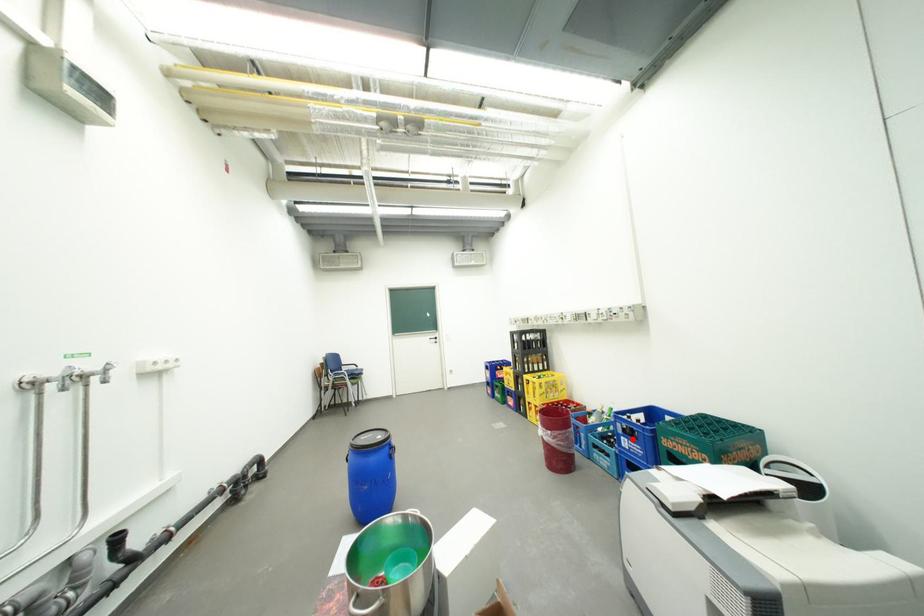
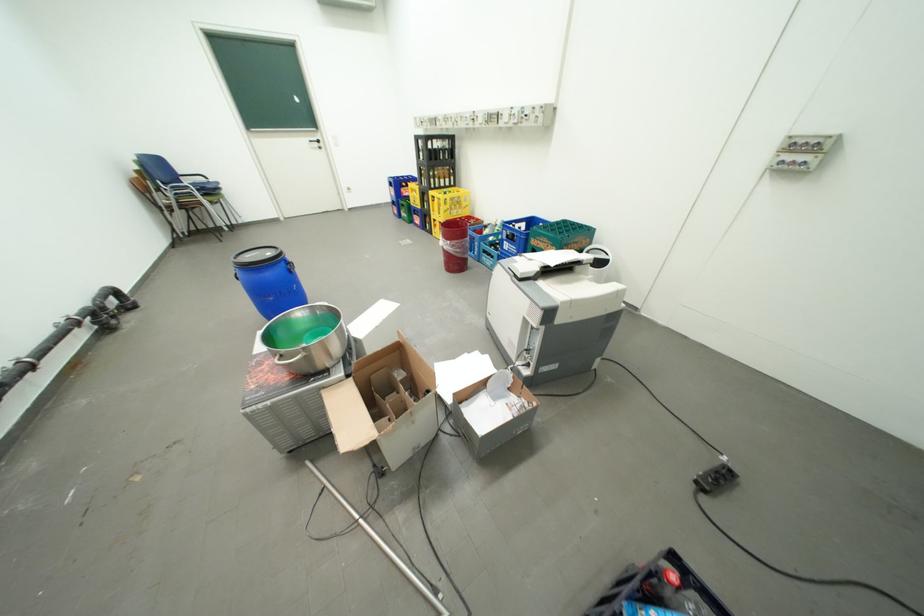
Question: I am providing you with two images of the same scene from different viewpoints. Image1 has a red point marked. In image2, the corresponding 3D location appears at what relative position? Reply with the corresponding letter.

Choices:
 (A) Closer
 (B) Farther

Answer: (B)